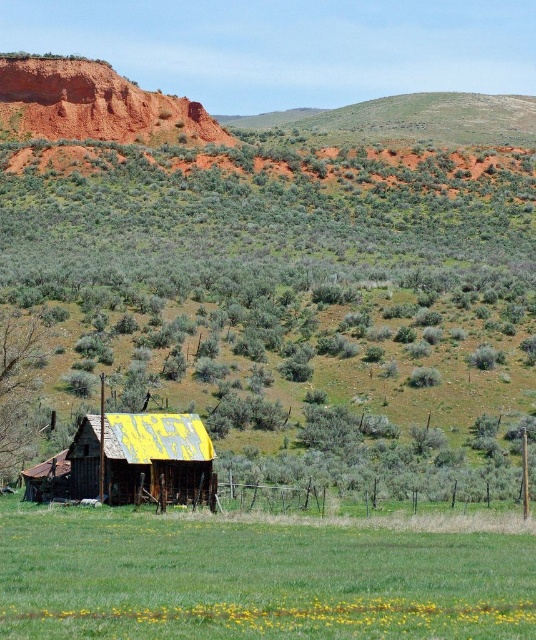
Question: Is green grassy field at lower center positioned at the back of rusty corrugated metal hut at lower left?

Choices:
 (A) no
 (B) yes

Answer: (A)

Question: Among these objects, which one is nearest to the camera?

Choices:
 (A) rusty corrugated metal hut at lower left
 (B) green grassy field at lower center

Answer: (B)

Question: Considering the relative positions of green grassy field at lower center and rusty corrugated metal hut at lower left in the image provided, where is green grassy field at lower center located with respect to rusty corrugated metal hut at lower left?

Choices:
 (A) above
 (B) below

Answer: (B)

Question: Can you confirm if green grassy field at lower center is thinner than rusty corrugated metal hut at lower left?

Choices:
 (A) yes
 (B) no

Answer: (B)